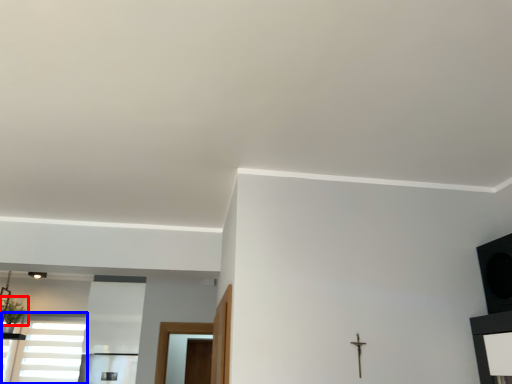
Question: Which object is closer to the camera taking this photo, plant (highlighted by a red box) or window (highlighted by a blue box)?

Choices:
 (A) plant
 (B) window

Answer: (A)